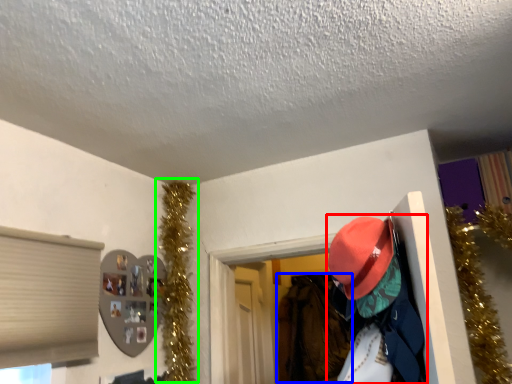
Question: Estimate the real-world distances between objects in this image. Which object is farther from person (highlighted by a red box), clothing (highlighted by a blue box) or christmas decoration (highlighted by a green box)?

Choices:
 (A) clothing
 (B) christmas decoration

Answer: (A)